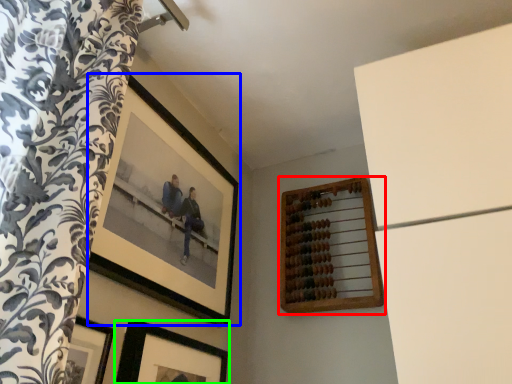
Question: Considering the real-world distances, which object is farthest from picture frame (highlighted by a red box)? picture frame (highlighted by a blue box) or picture frame (highlighted by a green box)?

Choices:
 (A) picture frame
 (B) picture frame

Answer: (B)